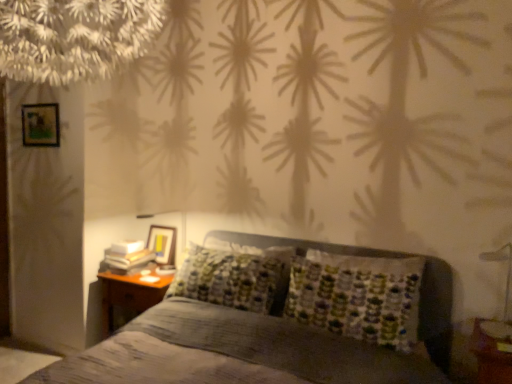
You are a GUI agent. You are given a task and a screenshot of the screen. Output one action in this format:
    pyautogui.click(x=<x>, y=<y>)
    Task: Click on the free location above wooden glossy picture frame at upper left, arranged as the 1th picture frame when ordered from the bottom (from a real-world perspective)
    Image resolution: width=512 pixels, height=384 pixels.
    Given the screenshot: What is the action you would take?
    pyautogui.click(x=157, y=222)